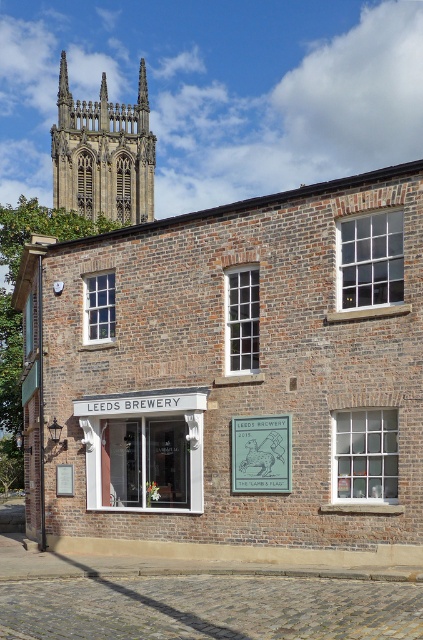
You are standing in front of the Leeds Brewery building and want to take a photo of both the dark brown stone tower at upper left and the green metal sign at center. Which object should you focus on first to ensure both are in the frame?

You should focus on the dark brown stone tower at upper left first because it is closer to you than the green metal sign at center, so adjusting the camera to include it will also capture the sign in the background.

You are standing in front of the Leeds Brewery building and want to touch both the point at coordinates point (91, 435) and the point at coordinates point (250, 452). Which point will you reach first?

You will reach the point at coordinates point (91, 435) first because it is closer to you than the point at coordinates point (250, 452), which is further away.

You are standing in front of the brick building and want to locate the white wooden signboard at center. According to the coordinates provided, where exactly should you look to find it?

The white wooden signboard at center is located at point coordinates 0.703 on the x axis and 0.340 on the y axis.